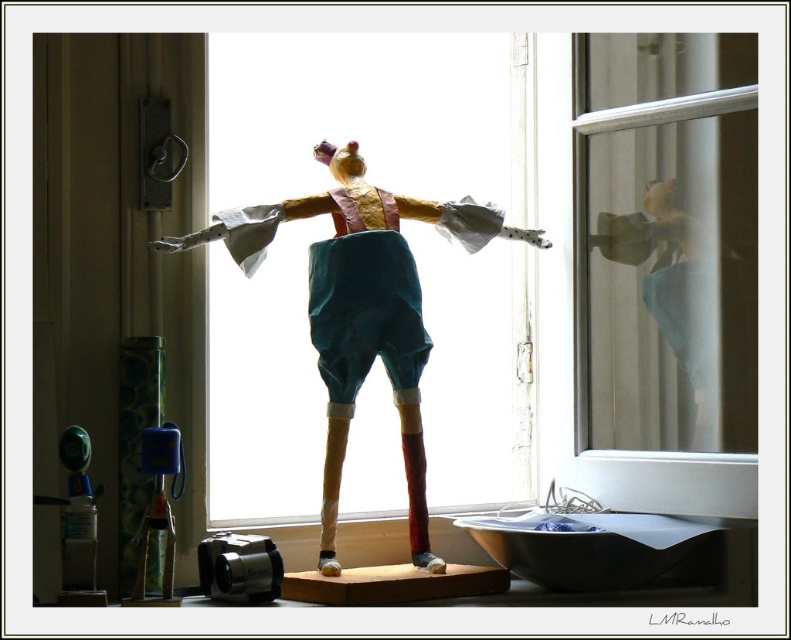
You are holding a 1.2 meter long pole. You want to reach the transparent glass window at center to clean it. Can you reach it with your pole?

The transparent glass window at center is 1.21 meters away from the camera. Since your pole is 1.2 meters long, it is slightly shorter than the required distance. You cannot reach the window with your current pole.

You are a delivery person trying to place a new transparent glass window at center in the room. The current window is broken and needs replacement. However, there is a translucent plastic bottle at lower left blocking the installation path. Can you move the bottle to the side to make space for the new window?

The transparent glass window at center might be wider than the translucent plastic bottle at lower left, so you should move the translucent plastic bottle at lower left out of the way to ensure there is enough space for the new window.